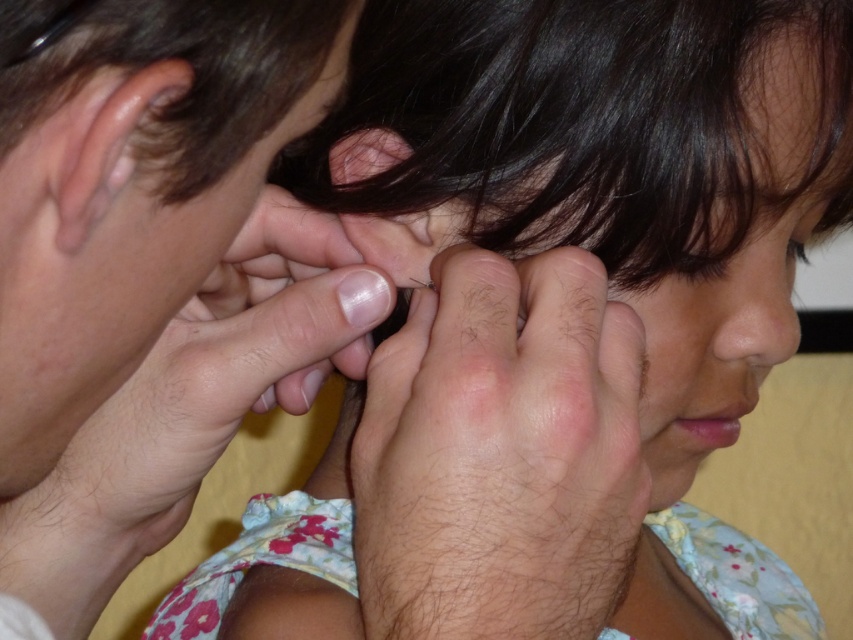
Does smooth skin face at upper left appear on the right side of hair at center?

In fact, smooth skin face at upper left is to the left of hair at center.

Is smooth skin face at upper left bigger than hair at center?

Actually, smooth skin face at upper left might be smaller than hair at center.

Is point (120, 125) less distant than point (424, 310)?

That is True.

Image resolution: width=853 pixels, height=640 pixels. Find the location of `smooth skin face at upper left`. smooth skin face at upper left is located at coordinates (131, 180).

Is smooth skin face at upper left taller than matte black ear at upper center?

Yes.

Who is more distant from viewer, (x=331, y=76) or (x=340, y=182)?

The point (x=340, y=182) is behind.

Image resolution: width=853 pixels, height=640 pixels. I want to click on smooth skin face at upper left, so click(131, 180).

How distant is hair at center from matte black ear at upper center?

A distance of 4.70 inches exists between hair at center and matte black ear at upper center.

Is hair at center below matte black ear at upper center?

Correct, hair at center is located below matte black ear at upper center.

Identify the location of hair at center. (498, 452).

Image resolution: width=853 pixels, height=640 pixels. I want to click on hair at center, so click(498, 452).